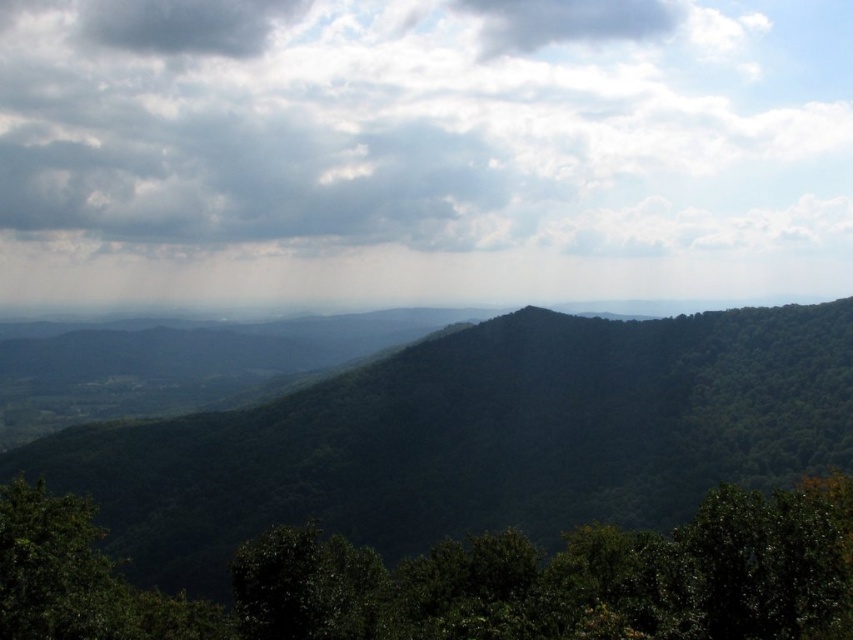
Question: Which point appears closest to the camera in this image?

Choices:
 (A) (103, 6)
 (B) (560, 20)

Answer: (B)

Question: Which of the following is the closest to the observer?

Choices:
 (A) (799, 637)
 (B) (126, 48)
 (C) (576, 241)
 (D) (627, 17)

Answer: (A)

Question: Does cloudy sky at upper center appear over green leafy tree at lower center?

Choices:
 (A) yes
 (B) no

Answer: (A)

Question: Observing the image, what is the correct spatial positioning of green leafy tree at lower center in reference to dark gray cloud at upper left?

Choices:
 (A) above
 (B) below

Answer: (B)

Question: Which point is closer to the camera?

Choices:
 (A) gray fluffy cloud at upper center
 (B) dark gray cloud at upper left
 (C) green leafy forest at center

Answer: (C)

Question: Is green leafy tree at lower center further to camera compared to dark gray cloud at upper left?

Choices:
 (A) yes
 (B) no

Answer: (B)